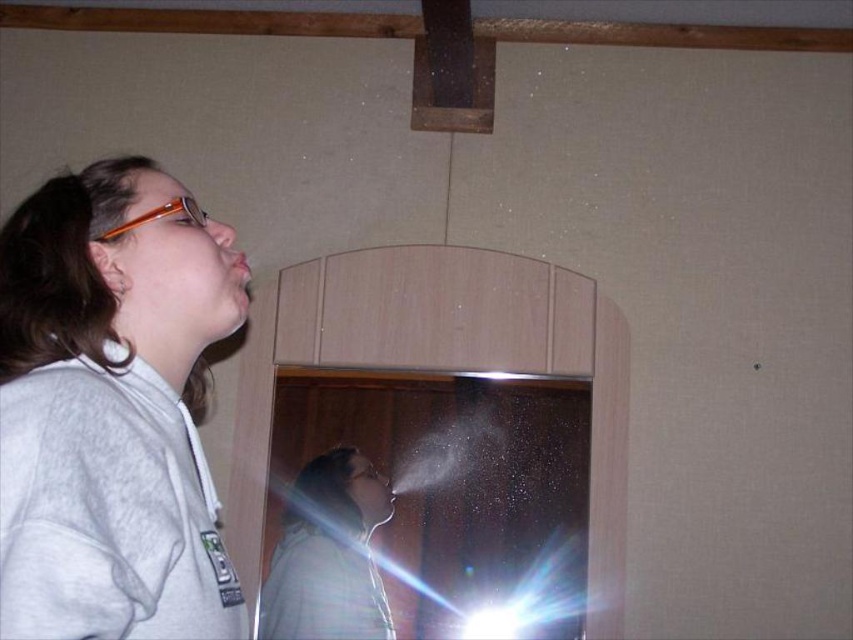
Based on the photo, can you confirm if gray fleece jacket at upper left is positioned to the left of matte gray shirt at center?

Correct, you'll find gray fleece jacket at upper left to the left of matte gray shirt at center.

Can you confirm if gray fleece jacket at upper left is positioned below matte gray shirt at center?

Actually, gray fleece jacket at upper left is above matte gray shirt at center.

Locate an element on the screen. gray fleece jacket at upper left is located at coordinates (109, 410).